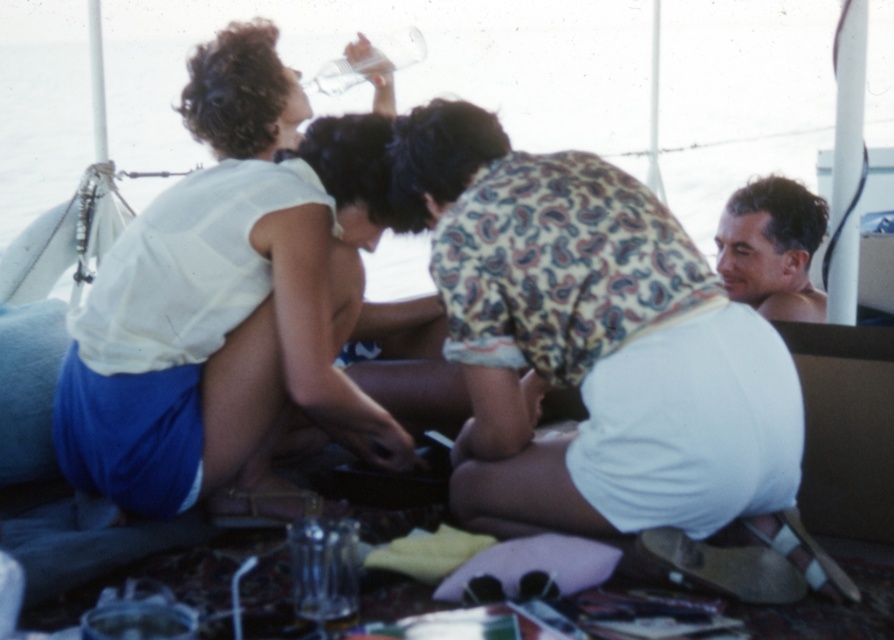
Question: Where is white cotton shirt at upper left located in relation to smooth skin face at upper right in the image?

Choices:
 (A) above
 (B) below

Answer: (B)

Question: Is white cotton shirt at center to the right of white cotton shirt at upper left from the viewer's perspective?

Choices:
 (A) yes
 (B) no

Answer: (A)

Question: Among these points, which one is nearest to the camera?

Choices:
 (A) (724, 266)
 (B) (431, 212)

Answer: (B)

Question: Which point is closer to the camera?

Choices:
 (A) (736, 250)
 (B) (104, 426)

Answer: (B)

Question: Which point appears farthest from the camera in this image?

Choices:
 (A) (221, 83)
 (B) (795, 224)
 (C) (630, 493)

Answer: (B)

Question: Does white cotton shirt at upper left have a greater width compared to smooth skin face at upper right?

Choices:
 (A) yes
 (B) no

Answer: (A)